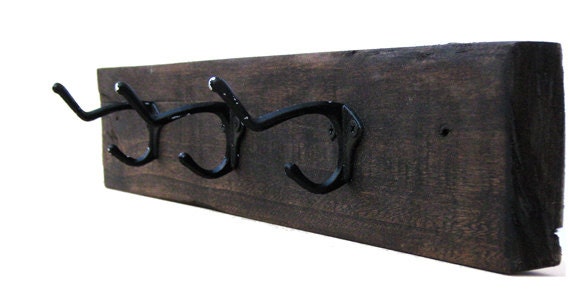
Find the location of a particular element. left hanger is located at coordinates (63, 92).